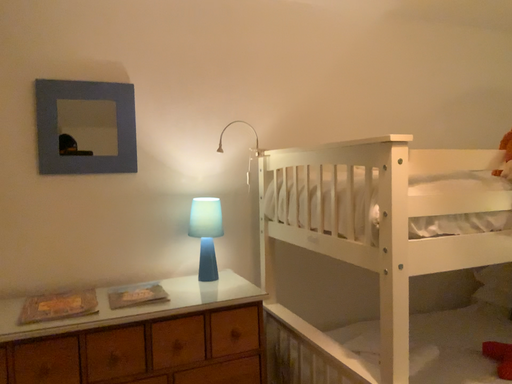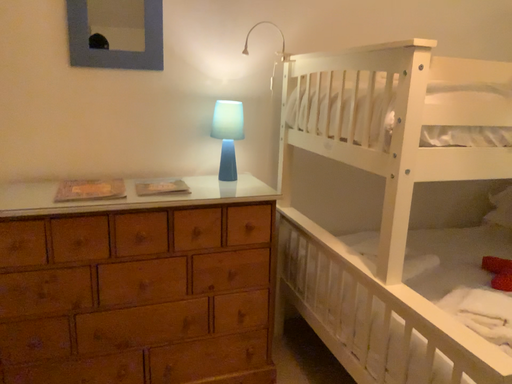
Question: How did the camera likely rotate when shooting the video?

Choices:
 (A) rotated downward
 (B) rotated upward

Answer: (A)